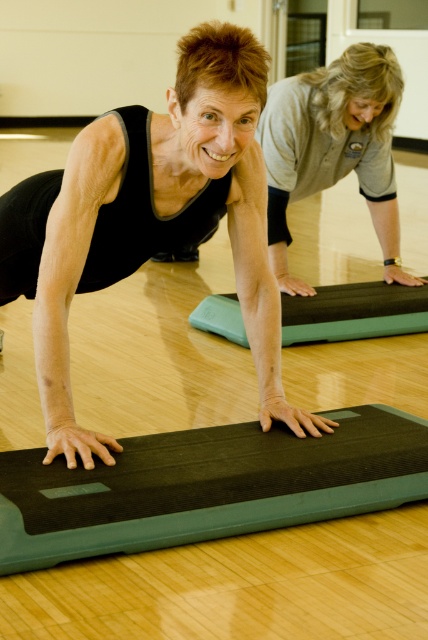
You are a fitness instructor observing two participants in a plank exercise. You see the black rubber yoga mat at center and the green rubber yoga mat at center. Which mat is closer to you?

The black rubber yoga mat at center is closer to you because it is positioned in front of the green rubber yoga mat at center.

You are a fitness instructor observing two participants in a plank exercise. You notice both are on their own black rubber yoga mat at center and green rubber yoga mat at center. Which mat allows the participant to have more space for their plank position?

The black rubber yoga mat at center has a larger width than the green rubber yoga mat at center, so the participant on the black rubber yoga mat at center has more space for their plank position.

You are standing in a gym and see a point marked at coordinates (219, 48). If you want to place a 6.5 feet long yoga mat there, will it fit without overlapping the camera view?

The point is 6.86 feet from the camera, which is slightly farther than the 6.5 feet length of the yoga mat. Therefore, placing the yoga mat at that point would allow it to fit without overlapping the camera view.